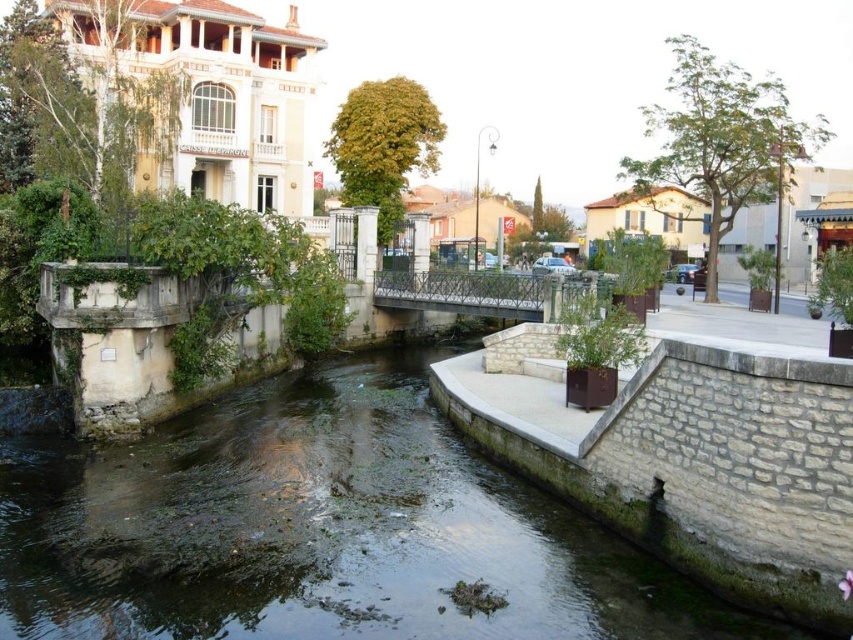
You are a drone operator tasked with capturing aerial footage of the urban riverside scene. Your drone is currently hovering at the point marked by the coordinates point (318, 529). Based on the scene description, what specific geographic feature is your drone directly above?

The point (318, 529) marks green mossy stone river at center, so the drone is directly above the green mossy stone river at center.

You are a city planner reviewing the riverside area. You need to determine which of the two elements, the green mossy stone river at center or the metallic bridge at center, requires more space for maintenance access. Based on their sizes, which one would need a larger maintenance area?

The metallic bridge at center is larger than the green mossy stone river at center, so it would require a larger maintenance area.

Consider the image. You are a pedestrian standing on the metallic bridge at center. Looking down, you see the green mossy stone river at center. Which direction is the river flowing relative to the bridge?

The green mossy stone river at center is located below the metallic bridge at center, so the river flows underneath the bridge, but the direction of the flow cannot be determined from the given information.